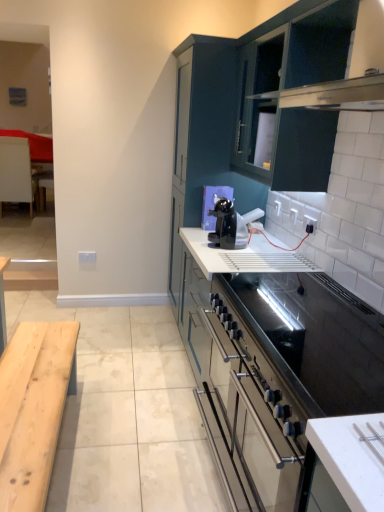
Question: Is white glossy electric outlet at upper right, the second electric outlet viewed from the left, bigger than black glossy coffee machine at center?

Choices:
 (A) no
 (B) yes

Answer: (A)

Question: Does white glossy electric outlet at upper right, the 1th electric outlet viewed from the front, lie behind black glossy coffee machine at center?

Choices:
 (A) no
 (B) yes

Answer: (A)

Question: Is white glossy electric outlet at upper right, which appears as the second electric outlet when ordered from the bottom, at the left side of black glossy coffee machine at center?

Choices:
 (A) no
 (B) yes

Answer: (A)

Question: Considering the relative sizes of white glossy electric outlet at upper right, the 1th electric outlet when ordered from top to bottom, and black glossy coffee machine at center in the image provided, is white glossy electric outlet at upper right, the 1th electric outlet when ordered from top to bottom, wider than black glossy coffee machine at center?

Choices:
 (A) yes
 (B) no

Answer: (B)

Question: Is black glossy coffee machine at center at the back of white glossy electric outlet at upper right, which appears as the second electric outlet when ordered from the bottom?

Choices:
 (A) yes
 (B) no

Answer: (B)

Question: Considering the positions of point (206, 54) and point (291, 291), is point (206, 54) closer or farther from the camera than point (291, 291)?

Choices:
 (A) closer
 (B) farther

Answer: (B)

Question: Is matte dark blue cabinet at upper center, arranged as the 1th cabinetry when viewed from the back, wider or thinner than white matte countertop at center?

Choices:
 (A) wide
 (B) thin

Answer: (B)

Question: In terms of height, does matte dark blue cabinet at upper center, arranged as the 1th cabinetry when viewed from the back, look taller or shorter compared to white matte countertop at center?

Choices:
 (A) tall
 (B) short

Answer: (A)

Question: In terms of size, does matte dark blue cabinet at upper center, arranged as the 1th cabinetry when viewed from the back, appear bigger or smaller than white matte countertop at center?

Choices:
 (A) small
 (B) big

Answer: (B)

Question: Considering their positions, is white glossy electric outlet at upper right, the second electric outlet viewed from the left, located in front of or behind white wood table at left?

Choices:
 (A) front
 (B) behind

Answer: (A)

Question: Considering the positions of point (312, 222) and point (21, 193), is point (312, 222) closer or farther from the camera than point (21, 193)?

Choices:
 (A) farther
 (B) closer

Answer: (B)

Question: Looking at their shapes, would you say white glossy electric outlet at upper right, which appears as the second electric outlet when ordered from the bottom, is wider or thinner than white wood table at left?

Choices:
 (A) wide
 (B) thin

Answer: (B)

Question: Choose the correct answer: Is white glossy electric outlet at upper right, the 1th electric outlet when ordered from top to bottom, inside white wood table at left or outside it?

Choices:
 (A) outside
 (B) inside

Answer: (A)

Question: Considering the relative positions of matte dark blue cabinet at upper center, the second cabinetry in the front-to-back sequence, and white wood table at left in the image provided, is matte dark blue cabinet at upper center, the second cabinetry in the front-to-back sequence, to the left or to the right of white wood table at left?

Choices:
 (A) left
 (B) right

Answer: (B)

Question: From a real-world perspective, is matte dark blue cabinet at upper center, the second cabinetry in the front-to-back sequence, above or below white wood table at left?

Choices:
 (A) above
 (B) below

Answer: (A)